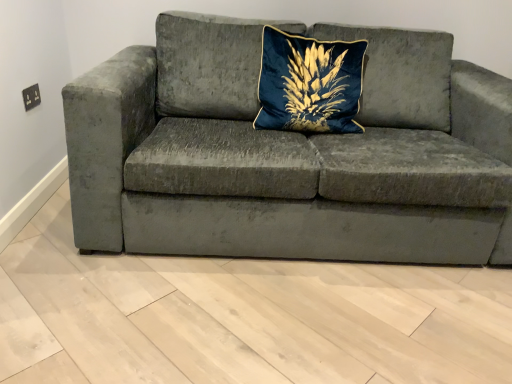
Question: Should I look upward or downward to see velvet gray couch at center?

Choices:
 (A) down
 (B) up

Answer: (B)

Question: Is velvet gray couch at center at the left side of velvet blue pillow at center?

Choices:
 (A) yes
 (B) no

Answer: (A)

Question: From a real-world perspective, does velvet gray couch at center stand above velvet blue pillow at center?

Choices:
 (A) no
 (B) yes

Answer: (A)

Question: Does velvet gray couch at center come behind velvet blue pillow at center?

Choices:
 (A) no
 (B) yes

Answer: (A)

Question: Does velvet gray couch at center appear on the right side of velvet blue pillow at center?

Choices:
 (A) yes
 (B) no

Answer: (B)

Question: Are velvet gray couch at center and velvet blue pillow at center making contact?

Choices:
 (A) yes
 (B) no

Answer: (B)

Question: From the image's perspective, is velvet gray couch at center over velvet blue pillow at center?

Choices:
 (A) no
 (B) yes

Answer: (A)

Question: Would you say velvet gray couch at center is part of velvet blue pillow at center's contents?

Choices:
 (A) no
 (B) yes

Answer: (A)

Question: Is velvet blue pillow at center next to velvet gray couch at center and touching it?

Choices:
 (A) yes
 (B) no

Answer: (B)

Question: From a real-world perspective, is velvet blue pillow at center physically above velvet gray couch at center?

Choices:
 (A) yes
 (B) no

Answer: (A)

Question: From a real-world perspective, is velvet blue pillow at center physically below velvet gray couch at center?

Choices:
 (A) yes
 (B) no

Answer: (B)

Question: Is the depth of velvet blue pillow at center less than that of velvet gray couch at center?

Choices:
 (A) no
 (B) yes

Answer: (A)

Question: Considering the relative sizes of velvet blue pillow at center and velvet gray couch at center in the image provided, is velvet blue pillow at center shorter than velvet gray couch at center?

Choices:
 (A) yes
 (B) no

Answer: (A)

Question: Is velvet blue pillow at center in front of or behind velvet gray couch at center in the image?

Choices:
 (A) front
 (B) behind

Answer: (B)